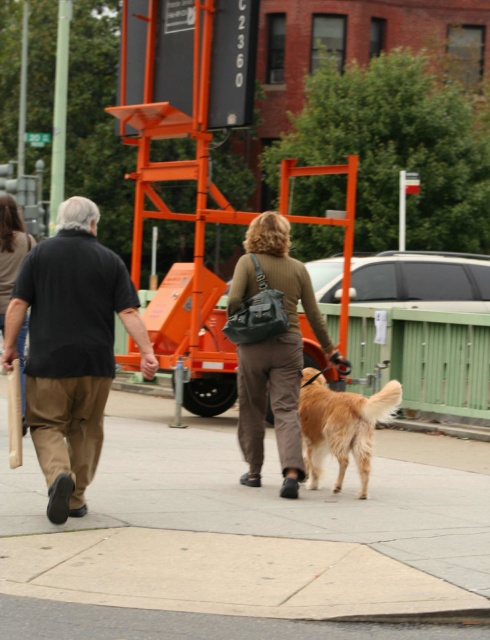
Question: Based on their relative distances, which object is farther from the golden fur dog at center?

Choices:
 (A) brown textured pants at center
 (B) matte black shirt at left
 (C) black cotton shirt at left
 (D) brown leather jacket at upper center

Answer: (D)

Question: Is matte black shirt at left behind brown leather jacket at upper center?

Choices:
 (A) no
 (B) yes

Answer: (A)

Question: Can you confirm if matte black shirt at left is positioned below black cotton shirt at left?

Choices:
 (A) yes
 (B) no

Answer: (A)

Question: Which object appears closest to the camera in this image?

Choices:
 (A) gray concrete sidewalk at center
 (B) brown leather jacket at upper center

Answer: (A)

Question: Can you confirm if matte black shirt at left is positioned to the left of brown textured pants at center?

Choices:
 (A) yes
 (B) no

Answer: (A)

Question: Among these objects, which one is nearest to the camera?

Choices:
 (A) golden fur dog at center
 (B) gray concrete sidewalk at center
 (C) brown leather jacket at upper center

Answer: (B)